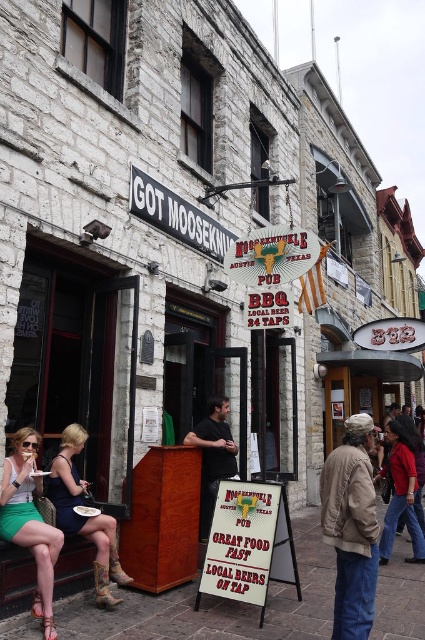
You are a customer looking to read both the white paper sign at center and the blacksign at upper center outside the restaurant. Which sign is narrower?

The white paper sign at center has a lesser width compared to blacksign at upper center, so the white paper sign at center is narrower.

You are standing in front of the Got Mooseknuckle restaurant in Austin, Texas. You see two points marked on the sandwich board sign. Which point, point (5, 540) or point (88, 536), is closer to you?

Point (5, 540) is closer to you than point (88, 536).

You are a customer approaching the entrance of Got Mooseknuckle restaurant in Austin, Texas. You see the white paper sign at center and the leather boots at lower left. Which object is closer to the entrance?

The white paper sign at center is closer to the entrance because it is located below the leather boots at lower left, meaning it is positioned lower and closer to the ground where the entrance is located.